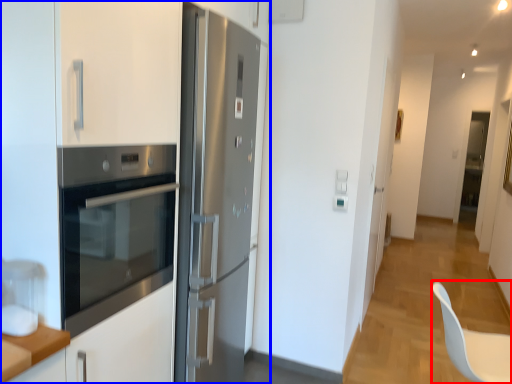
Question: Which point is closer to the camera, swivel chair (highlighted by a red box) or cabinetry (highlighted by a blue box)?

Choices:
 (A) swivel chair
 (B) cabinetry

Answer: (B)